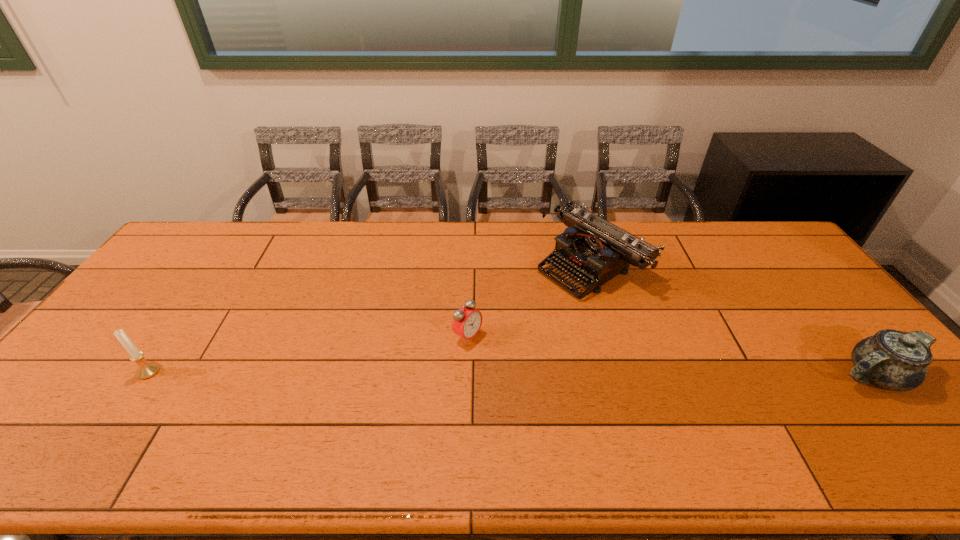
Identify the location of free space on the desktop that is between the candle holder and the chinaware and is positioned on the front-facing side of the third object from right to left. The height and width of the screenshot is (540, 960). (529, 374).

Locate an element on the screen. Image resolution: width=960 pixels, height=540 pixels. free space on the desktop that is between the candle holder and the chinaware and is positioned on the keyboard of the farthest object is located at coordinates (423, 373).